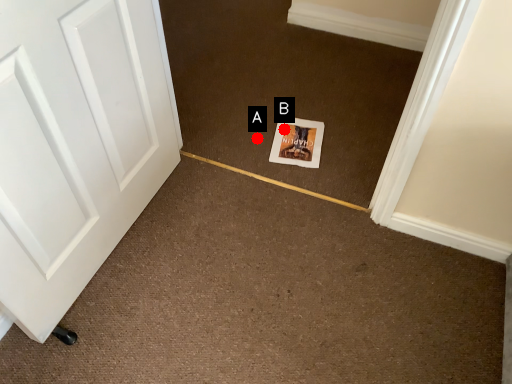
Question: Two points are circled on the image, labeled by A and B beside each circle. Which point appears closest to the camera in this image?

Choices:
 (A) A is closer
 (B) B is closer

Answer: (A)